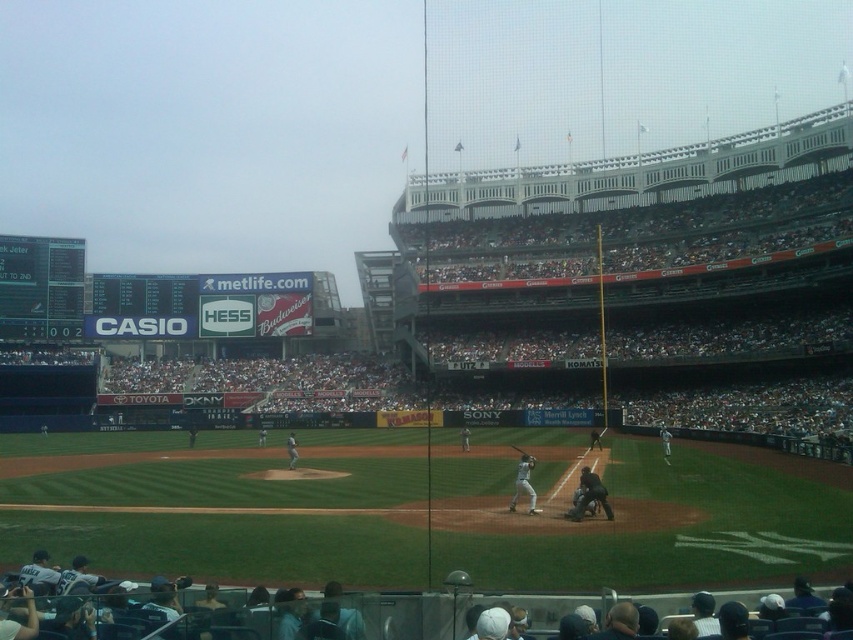
Question: Does black digital scoreboard at left appear under black leather umpire at center?

Choices:
 (A) yes
 (B) no

Answer: (B)

Question: Which is farther from the white matte bat at center?

Choices:
 (A) black leather umpire at center
 (B) metallic silver bat at center

Answer: (A)

Question: Is black digital scoreboard at left closer to camera compared to black leather umpire at center?

Choices:
 (A) no
 (B) yes

Answer: (A)

Question: Which object is positioned farthest from the black digital scoreboard at left?

Choices:
 (A) black leather umpire at center
 (B) white matte bat at center

Answer: (A)

Question: Which object is farther from the camera taking this photo?

Choices:
 (A) white matte bat at center
 (B) metallic silver bat at center
 (C) black digital scoreboard at left

Answer: (C)

Question: Is black leather umpire at center positioned at the back of metallic silver bat at center?

Choices:
 (A) no
 (B) yes

Answer: (A)